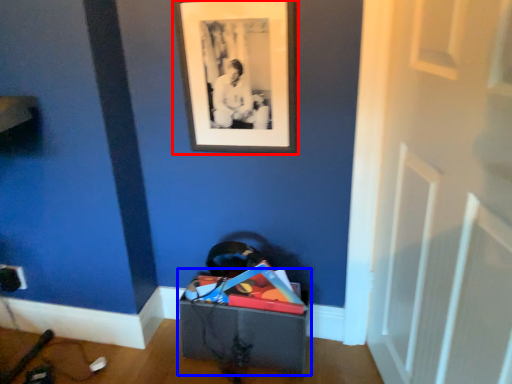
Question: Which of the following is the farthest to the observer, picture frame (highlighted by a red box) or storage box (highlighted by a blue box)?

Choices:
 (A) picture frame
 (B) storage box

Answer: (B)